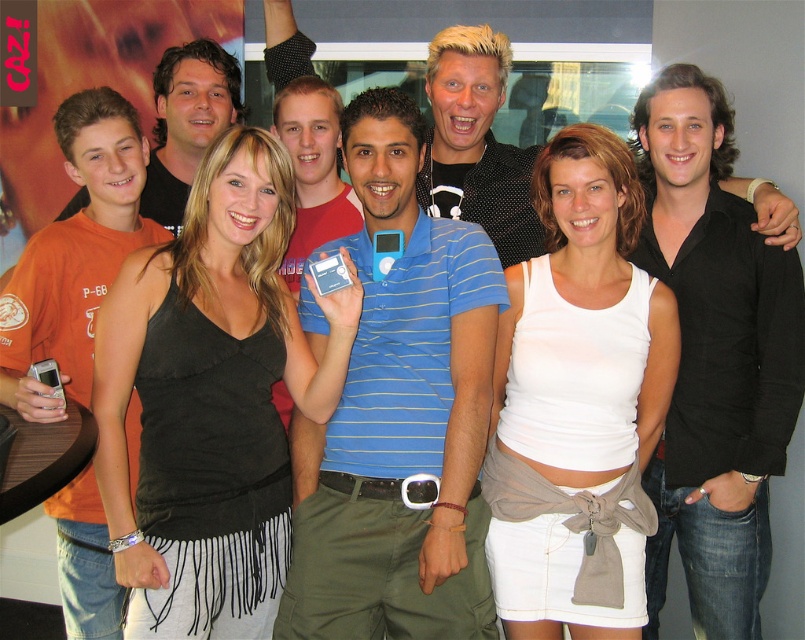
You are organizing a photo shoot and need to arrange the participants based on their clothing widths. Given that you have the blue striped polo shirt at center and the matte black shirt at upper left, which shirt should be placed on a wider rack?

The matte black shirt at upper left should be placed on the wider rack because the blue striped polo shirt at center is narrower than it according to the description.

In the scene shown: You are standing in the room where the group is posing. If you want to take a photo of the black fabric tank top at center, where should you aim your camera?

The black fabric tank top at center is located at the 2D coordinates point [211,401], so aim your camera at that point to capture it.